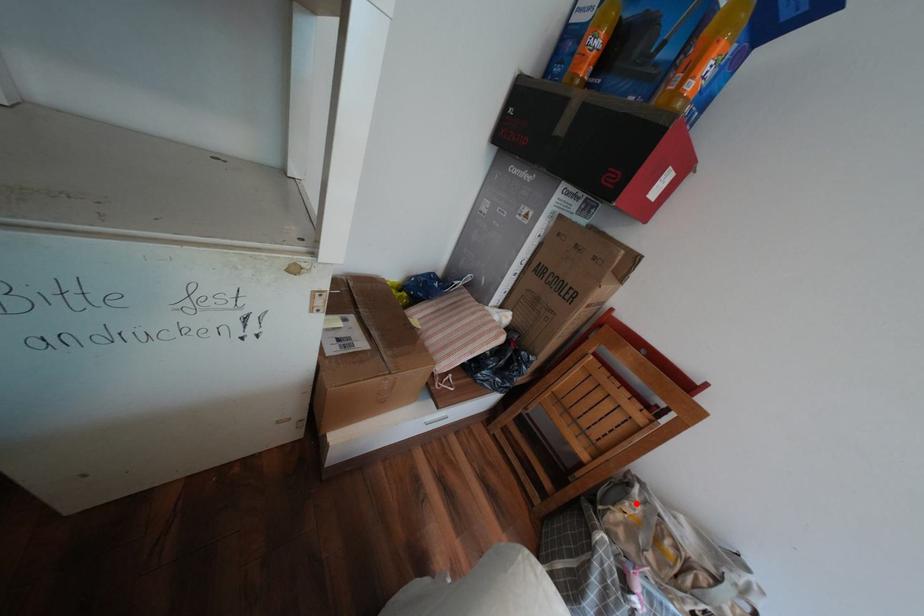
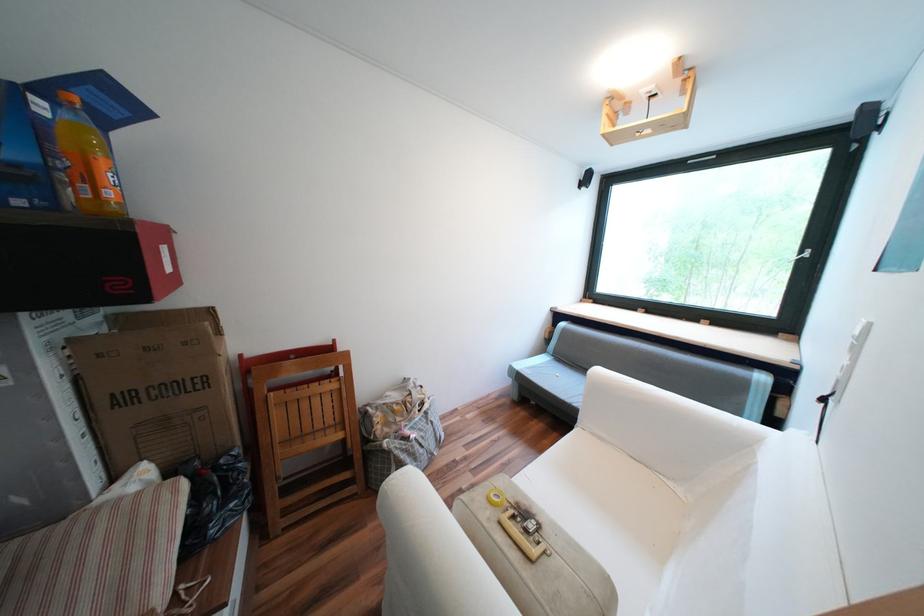
Question: I am providing you with two images of the same scene from different viewpoints. Image1 has a red point marked. In image2, the corresponding 3D location appears at what relative position? Reply with the corresponding letter.

Choices:
 (A) Closer
 (B) Farther

Answer: (B)